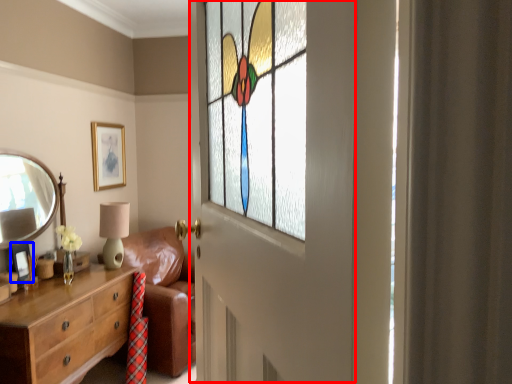
Question: Among these objects, which one is farthest to the camera, screen door (highlighted by a red box) or picture frame (highlighted by a blue box)?

Choices:
 (A) screen door
 (B) picture frame

Answer: (B)